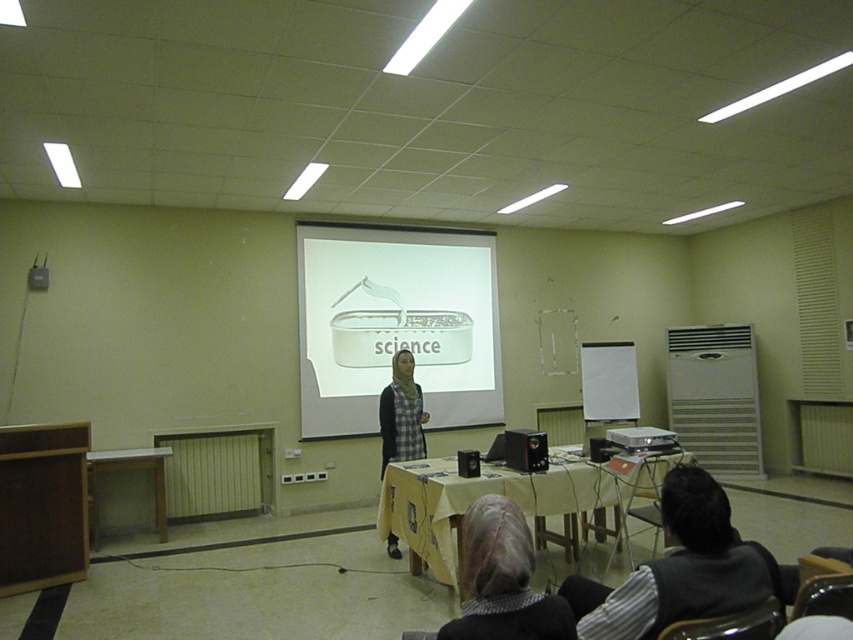
Question: Does white glossy projector screen at center have a greater width compared to black fabric at lower right?

Choices:
 (A) yes
 (B) no

Answer: (A)

Question: Does wooden table at center appear on the right side of plaid fabric hijab at center?

Choices:
 (A) yes
 (B) no

Answer: (A)

Question: Considering the real-world distances, which object is farthest from the plaid fabric hijab at center?

Choices:
 (A) wooden table at center
 (B) white glossy table at lower left
 (C) gray textured scarf at lower center

Answer: (C)

Question: Among these objects, which one is farthest from the camera?

Choices:
 (A) gray textured scarf at lower center
 (B) black fabric at lower right

Answer: (B)

Question: Is gray textured scarf at lower center to the left of wooden table at center from the viewer's perspective?

Choices:
 (A) yes
 (B) no

Answer: (A)

Question: Which point is closer to the camera?

Choices:
 (A) pos(727,573)
 (B) pos(483,632)

Answer: (B)